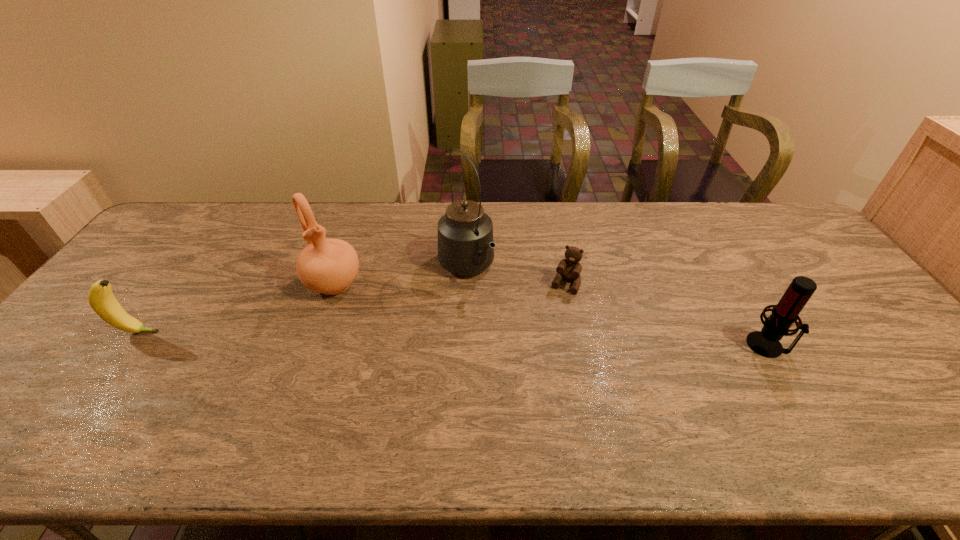
The image size is (960, 540). What are the coordinates of `free location located 0.280m from the stem of the leftmost object` in the screenshot? It's located at (264, 332).

Where is `blank space located on the back of the rightmost object`? blank space located on the back of the rightmost object is located at coordinates (704, 238).

Where is `vacant space situated on the spout of the pottery`? The height and width of the screenshot is (540, 960). vacant space situated on the spout of the pottery is located at coordinates (406, 387).

Find the location of `vacant point located 0.200m on the spout of the pottery`. vacant point located 0.200m on the spout of the pottery is located at coordinates (377, 346).

The height and width of the screenshot is (540, 960). In order to click on vacant region located 0.360m on the spout of the pottery in this screenshot , I will do `click(408, 390)`.

This screenshot has width=960, height=540. In order to click on vacant space situated on the face of the shortest object in this screenshot , I will do 510,401.

This screenshot has width=960, height=540. Find the location of `vacant point located on the face of the shortest object`. vacant point located on the face of the shortest object is located at coordinates (536, 348).

Locate an element on the screen. free point located on the face of the shortest object is located at coordinates (517, 384).

Find the location of a particular element. The image size is (960, 540). vacant space located spout on the tallest object is located at coordinates (493, 304).

In order to click on free space located spout on the tallest object in this screenshot , I will do `click(545, 364)`.